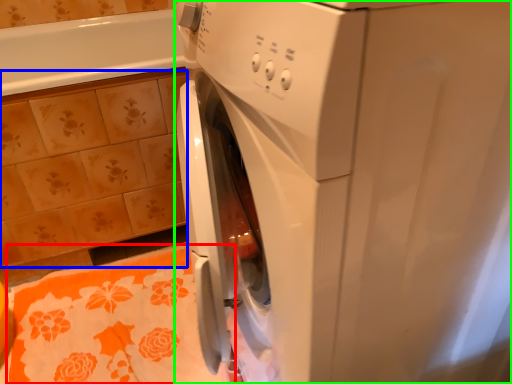
Question: Based on their relative distances, which object is nearer to bath towel (highlighted by a red box)? Choose from ceramic tile (highlighted by a blue box) and washing machine (highlighted by a green box).

Choices:
 (A) ceramic tile
 (B) washing machine

Answer: (A)